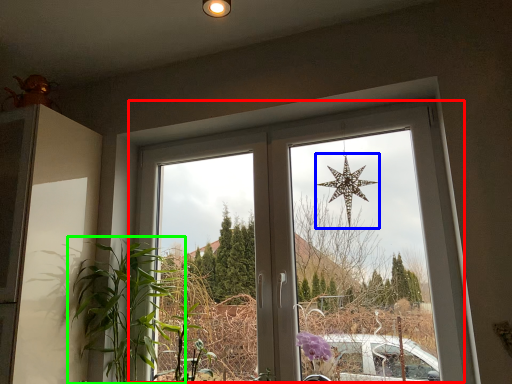
Question: Which object is positioned closest to window (highlighted by a red box)? Select from star (highlighted by a blue box) and houseplant (highlighted by a green box).

Choices:
 (A) star
 (B) houseplant

Answer: (A)